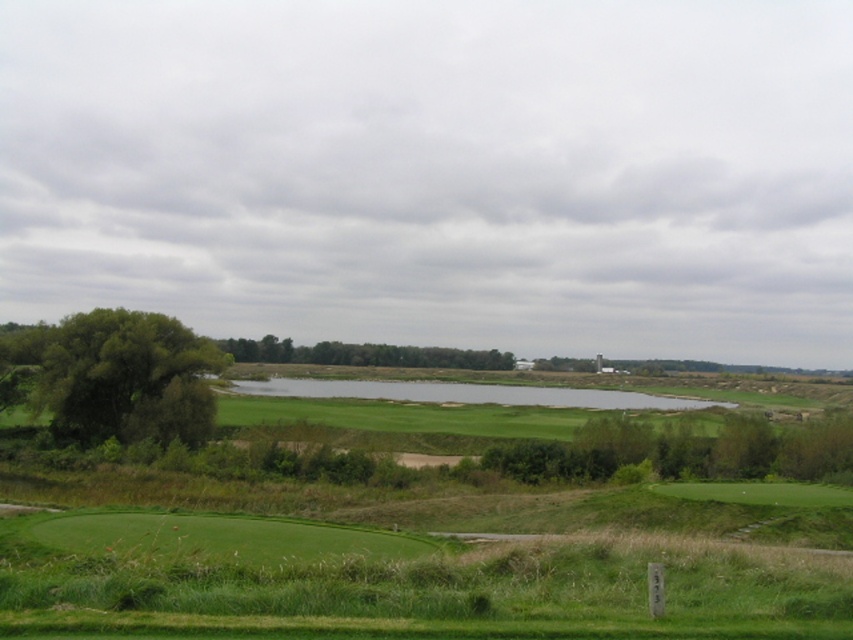
You are a golfer standing at the green leafy tree at left, aiming to hit a ball to the green leafy trees at center. What is the approximate distance you need to cover?

The distance between the green leafy tree at left and the green leafy trees at center is approximately 167.88 meters, so you need to cover around 168 meters.

You are a golfer standing at the tee, aiming to hit your ball to the green. You notice a green leafy tree at left and a clear water at center in your line of sight. If your drive can travel 80 meters, will you be able to reach the green without hitting any obstacles?

The green leafy tree at left and clear water at center are 77.38 meters apart. Since your drive can travel 80 meters, which is slightly longer than the distance between the two obstacles, you should be able to reach the green without hitting any obstacles if you aim accurately.

You are a golfer standing on the fairway and want to hit the ball over the clear water at center to reach the green area behind the green leafy trees at center. Can you see the green area beyond the water?

Yes, because the clear water at center is in front of the green leafy trees at center, so the golfer can see the green area beyond the water through the clear water.